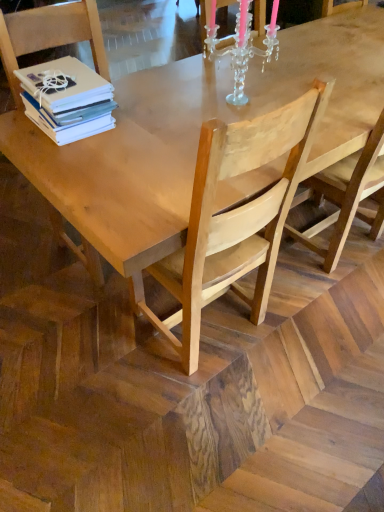
What are the coordinates of `space that is in front of light brown wooden chair at center, the 1th chair positioned from the right` in the screenshot? It's located at (201, 424).